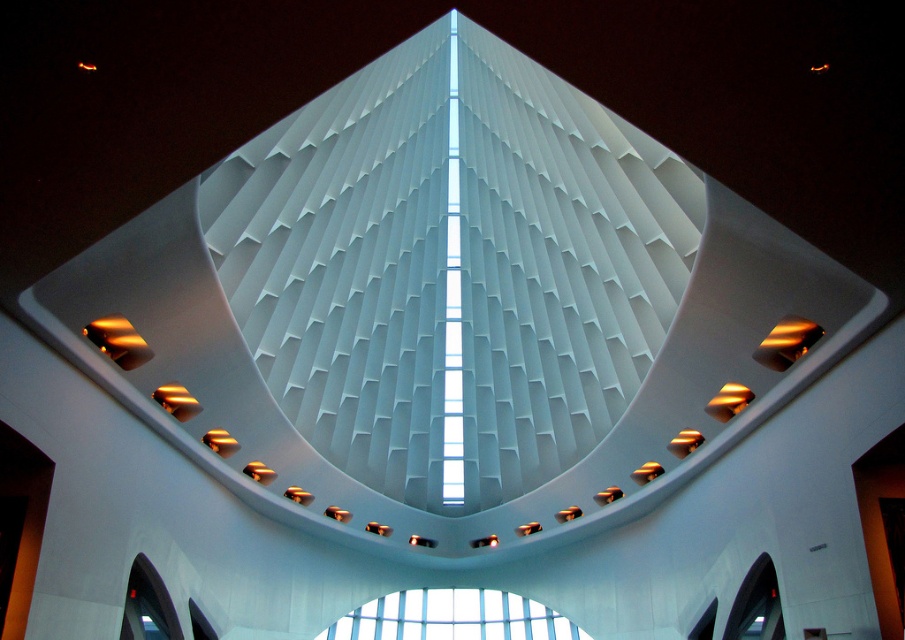
Who is taller, clear glass window at center or transparent glass window at lower right?

transparent glass window at lower right is taller.

You are a GUI agent. You are given a task and a screenshot of the screen. Output one action in this format:
    pyautogui.click(x=<x>, y=<y>)
    Task: Click on the clear glass window at center
    This screenshot has width=905, height=640.
    Given the screenshot: What is the action you would take?
    pyautogui.click(x=452, y=618)

Does point (424, 608) lie behind point (746, 582)?

Yes.

Locate an element on the screen. The width and height of the screenshot is (905, 640). clear glass window at center is located at coordinates (452, 618).